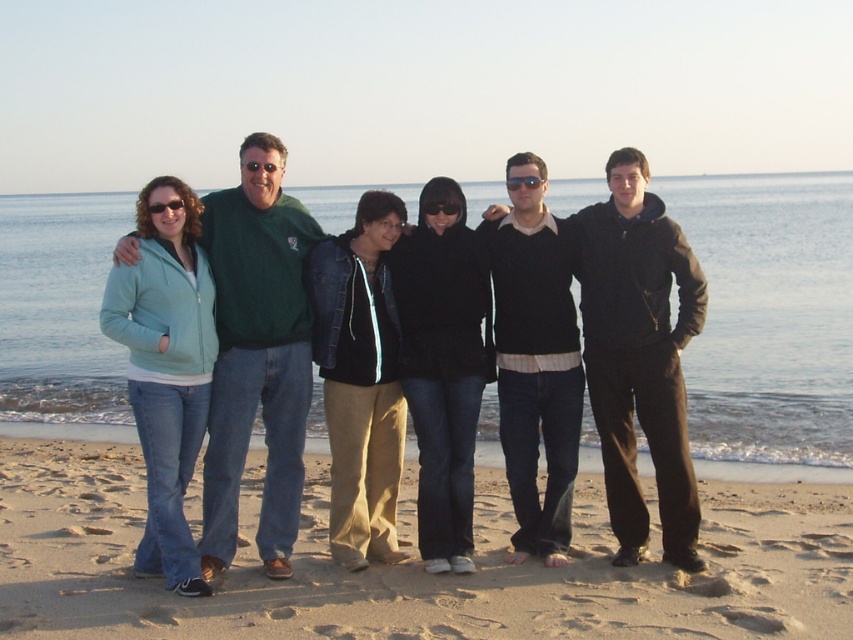
Is point (67, 492) less distant than point (625, 204)?

No.

How much distance is there between sandy brown sand at lower center and dark brown sweater at center?

sandy brown sand at lower center is 12.41 feet from dark brown sweater at center.

Who is more distant from viewer, (x=396, y=609) or (x=593, y=266)?

Point (x=593, y=266)

Locate an element on the screen. sandy brown sand at lower center is located at coordinates (415, 566).

Is sandy brown sand at lower center bigger than matte green sweater at center?

No.

Is sandy brown sand at lower center thinner than matte green sweater at center?

Indeed, sandy brown sand at lower center has a lesser width compared to matte green sweater at center.

Does point (668, 636) lie in front of point (523, 211)?

Yes, it is.

At what (x,y) coordinates should I click in order to perform the action: click on sandy brown sand at lower center. Please return your answer as a coordinate pair (x, y). Looking at the image, I should click on (415, 566).

Is sandy brown sand at lower center below green sweater at center?

Yes, sandy brown sand at lower center is below green sweater at center.

What do you see at coordinates (415, 566) in the screenshot? The image size is (853, 640). I see `sandy brown sand at lower center` at bounding box center [415, 566].

Which is behind, point (604, 604) or point (317, 227)?

Positioned behind is point (317, 227).

This screenshot has height=640, width=853. Identify the location of sandy brown sand at lower center. (415, 566).